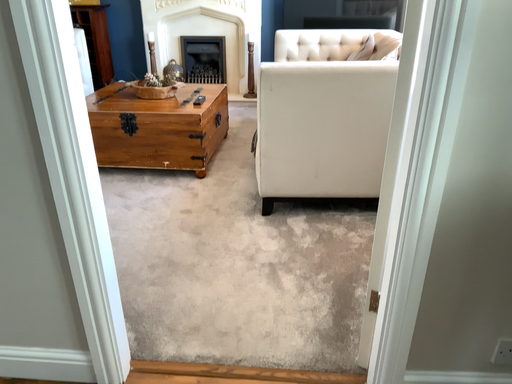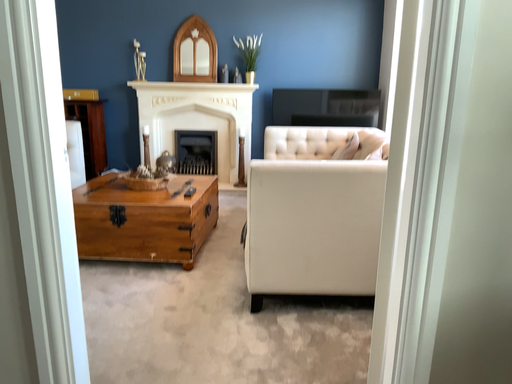
Question: Which way did the camera rotate in the video?

Choices:
 (A) rotated downward
 (B) rotated upward

Answer: (B)